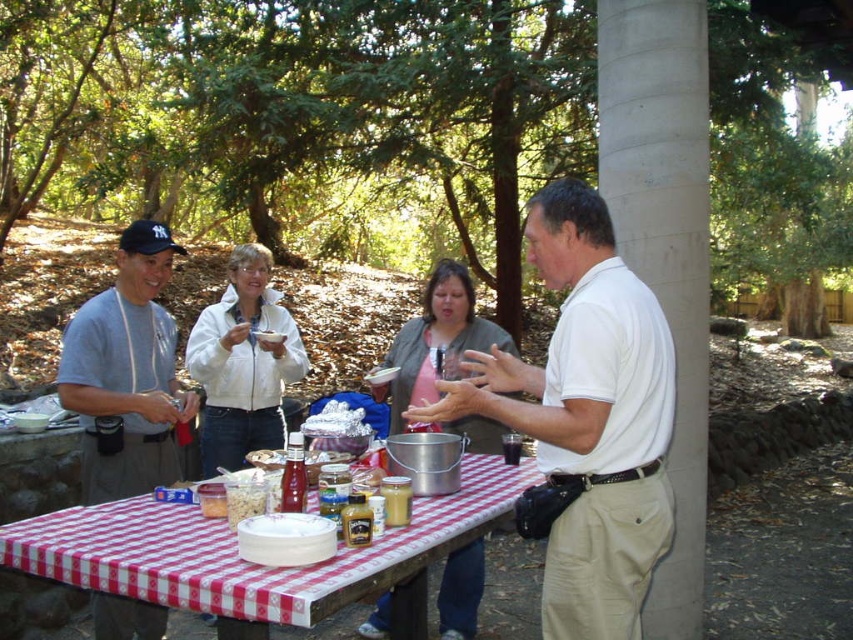
You are standing at the picnic table and want to place a new plate on the table. Where should you place it to avoid the white matte jacket at center?

The white matte jacket at center is located at position point (242,364), so you should place the new plate somewhere else on the table away from that coordinate.